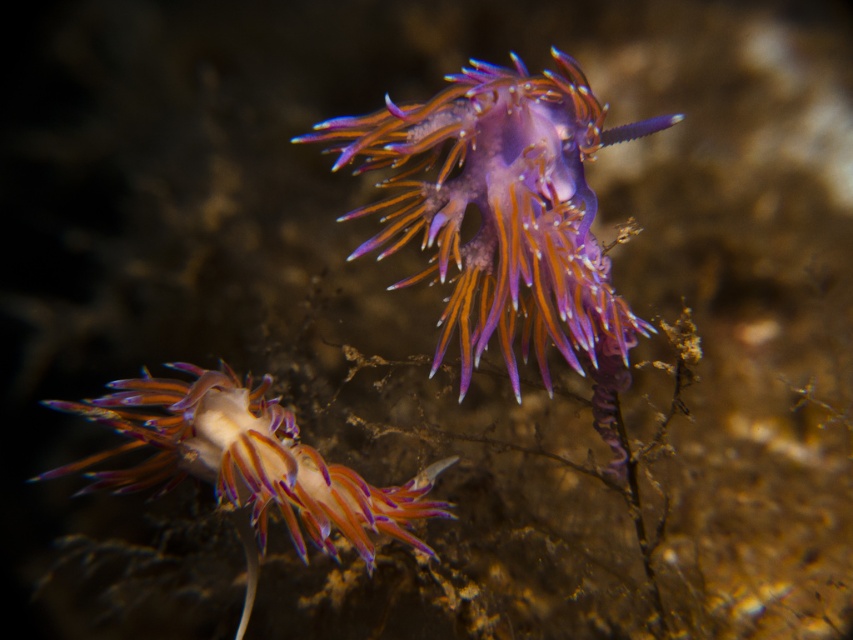
Question: Can you confirm if purple translucent nudibranch at center is positioned below translucent purple nudibranch at center?

Choices:
 (A) no
 (B) yes

Answer: (A)

Question: Is purple translucent nudibranch at center wider than translucent purple nudibranch at center?

Choices:
 (A) no
 (B) yes

Answer: (A)

Question: Can you confirm if purple translucent nudibranch at center is positioned to the left of translucent purple nudibranch at center?

Choices:
 (A) no
 (B) yes

Answer: (A)